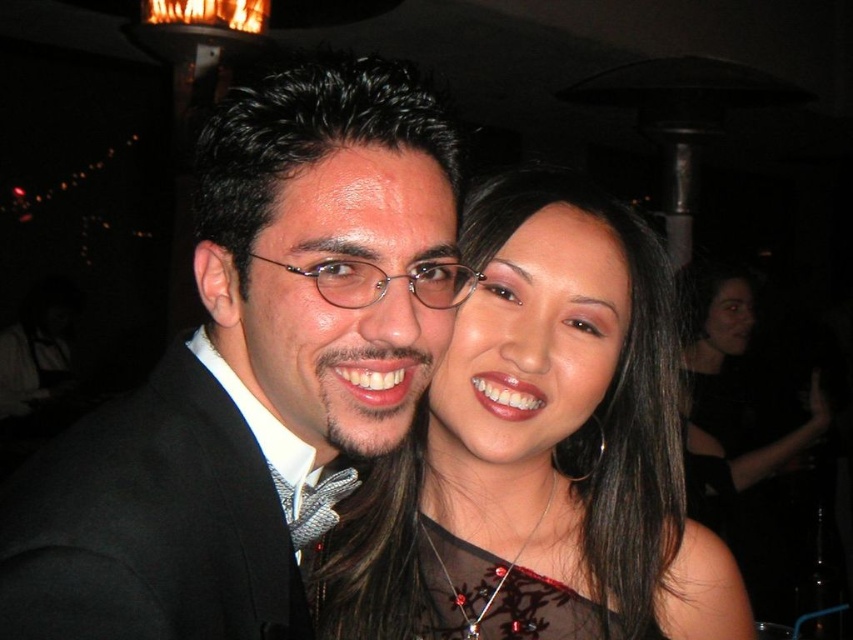
Question: Which point is closer to the camera?

Choices:
 (A) (469, 502)
 (B) (733, 442)
 (C) (160, 365)

Answer: (C)

Question: Which point appears closest to the camera in this image?

Choices:
 (A) (184, 435)
 (B) (277, 502)
 (C) (741, 438)
 (D) (488, 509)

Answer: (A)

Question: Can you confirm if black satin suit at center is thinner than black wool suit at left?

Choices:
 (A) yes
 (B) no

Answer: (B)

Question: Is black wool suit at left to the left of black satin dress at right from the viewer's perspective?

Choices:
 (A) no
 (B) yes

Answer: (B)

Question: Which object is positioned farthest from the satin black dress at center?

Choices:
 (A) black wool suit at left
 (B) black satin dress at right

Answer: (B)

Question: Is satin black dress at center closer to the viewer compared to black wool suit at left?

Choices:
 (A) no
 (B) yes

Answer: (A)